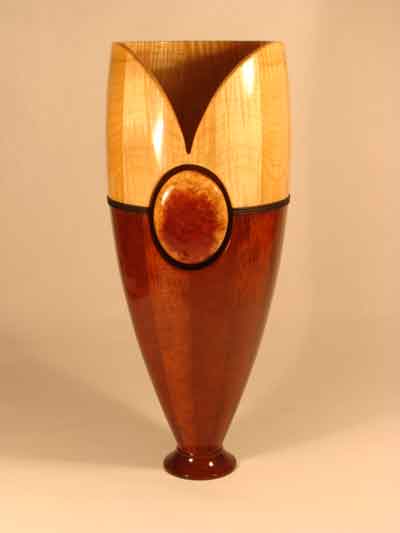
In order to click on vase in this screenshot , I will do `click(197, 289)`.